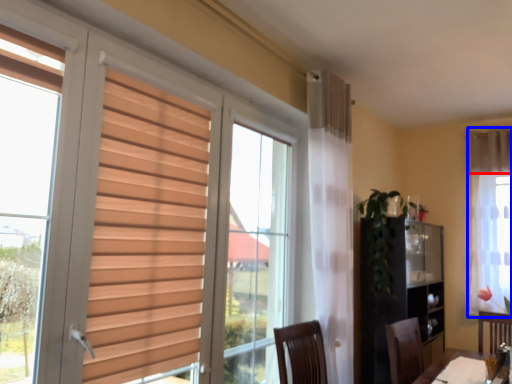
Question: Which object appears closest to the camera in this image, curtain (highlighted by a red box) or curtain (highlighted by a blue box)?

Choices:
 (A) curtain
 (B) curtain

Answer: (B)